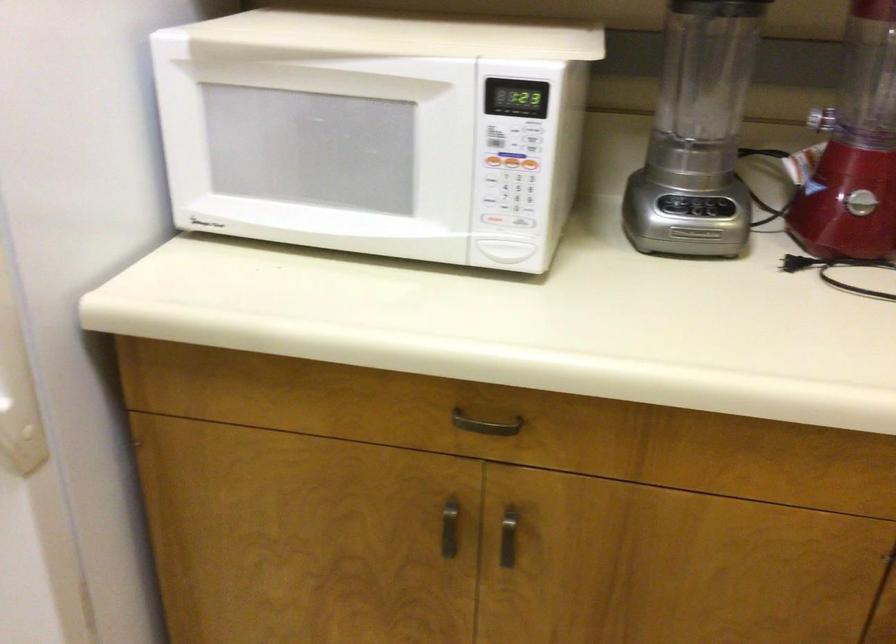
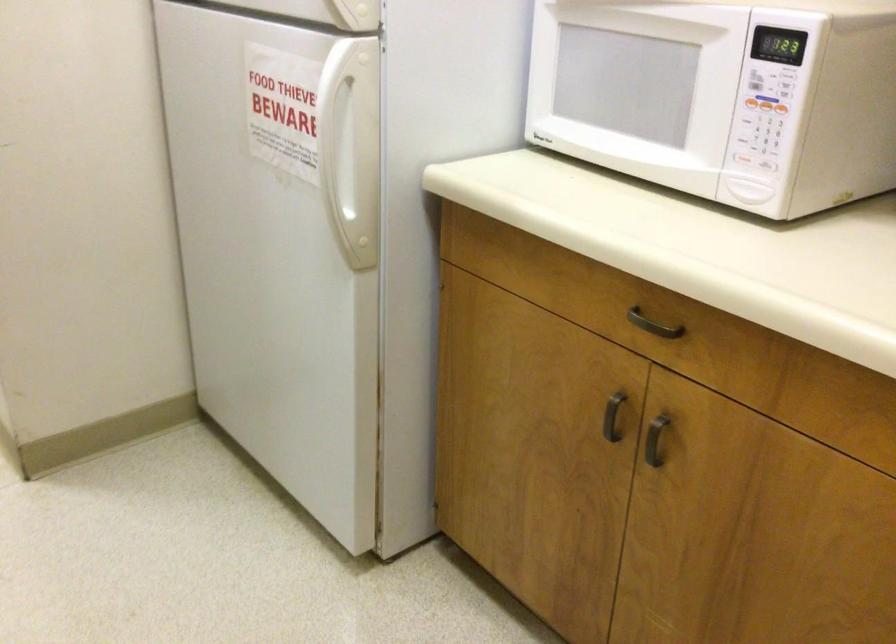
In the second image, find the point that corresponds to point 489,430 in the first image.

(652, 325)